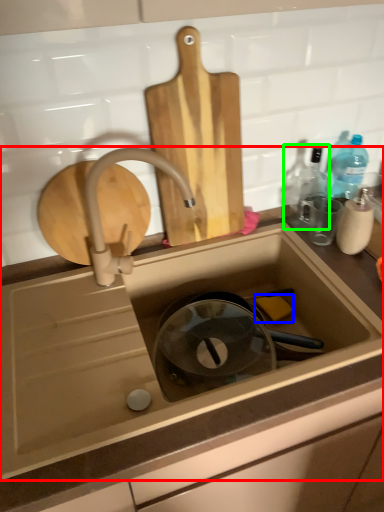
Question: Based on their relative distances, which object is nearer to sink (highlighted by a red box)? Choose from soap (highlighted by a blue box) and bottle (highlighted by a green box).

Choices:
 (A) soap
 (B) bottle

Answer: (A)